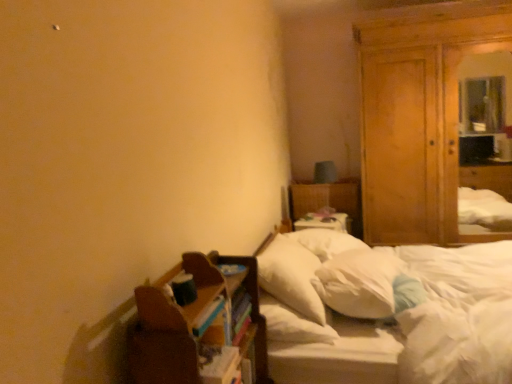
Question: Should I look upward or downward to see white soft mattress at center?

Choices:
 (A) down
 (B) up

Answer: (A)

Question: Can white fabric bed at center be found inside multicolored paper book at center?

Choices:
 (A) no
 (B) yes

Answer: (A)

Question: From the image's perspective, is multicolored paper book at center on top of white fabric bed at center?

Choices:
 (A) no
 (B) yes

Answer: (A)

Question: Is multicolored paper book at center not inside white fabric bed at center?

Choices:
 (A) no
 (B) yes

Answer: (B)

Question: Could you tell me if multicolored paper book at center is turned towards white fabric bed at center?

Choices:
 (A) no
 (B) yes

Answer: (A)

Question: Is multicolored paper book at center wider than white fabric bed at center?

Choices:
 (A) yes
 (B) no

Answer: (B)

Question: Is multicolored paper book at center far from white fabric bed at center?

Choices:
 (A) yes
 (B) no

Answer: (A)

Question: Can you confirm if white soft bed at center is positioned to the right of white soft mattress at center?

Choices:
 (A) yes
 (B) no

Answer: (B)

Question: Does white soft bed at center appear on the left side of white soft mattress at center?

Choices:
 (A) yes
 (B) no

Answer: (A)

Question: Is white soft bed at center positioned before white soft mattress at center?

Choices:
 (A) yes
 (B) no

Answer: (B)

Question: Is white soft mattress at center inside white soft bed at center?

Choices:
 (A) no
 (B) yes

Answer: (B)

Question: Is white soft bed at center behind white soft mattress at center?

Choices:
 (A) yes
 (B) no

Answer: (A)

Question: Is white soft bed at center oriented away from white soft mattress at center?

Choices:
 (A) yes
 (B) no

Answer: (A)

Question: From the image's perspective, does white fabric bed at center appear higher than brown wooden shelf at lower left?

Choices:
 (A) no
 (B) yes

Answer: (B)